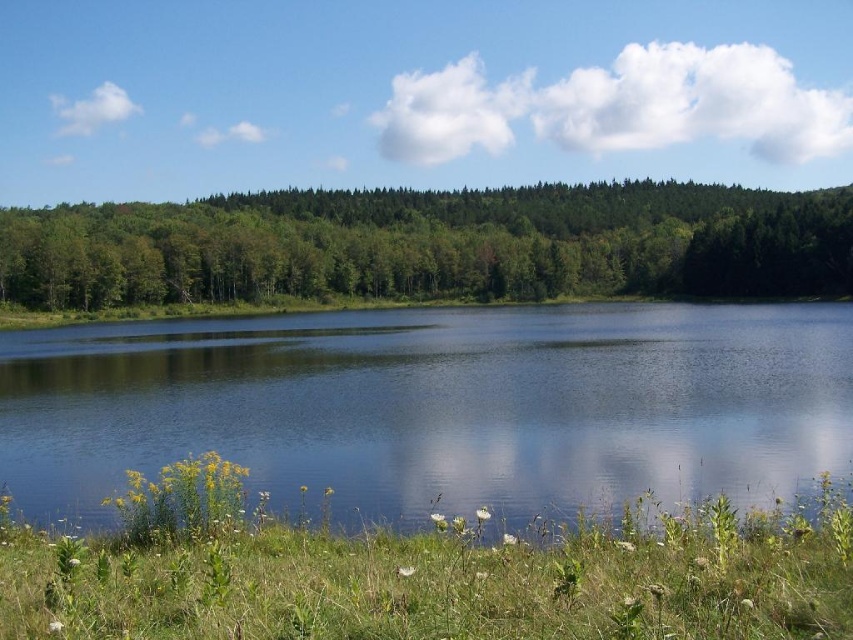
Who is positioned more to the right, transparent water at center or green leafy forest at upper center?

green leafy forest at upper center

Is transparent water at center below green leafy forest at upper center?

Indeed, transparent water at center is positioned under green leafy forest at upper center.

Who is more forward, (112, 381) or (773, 294)?

Point (112, 381)

Identify the location of transparent water at center. The image size is (853, 640). (436, 406).